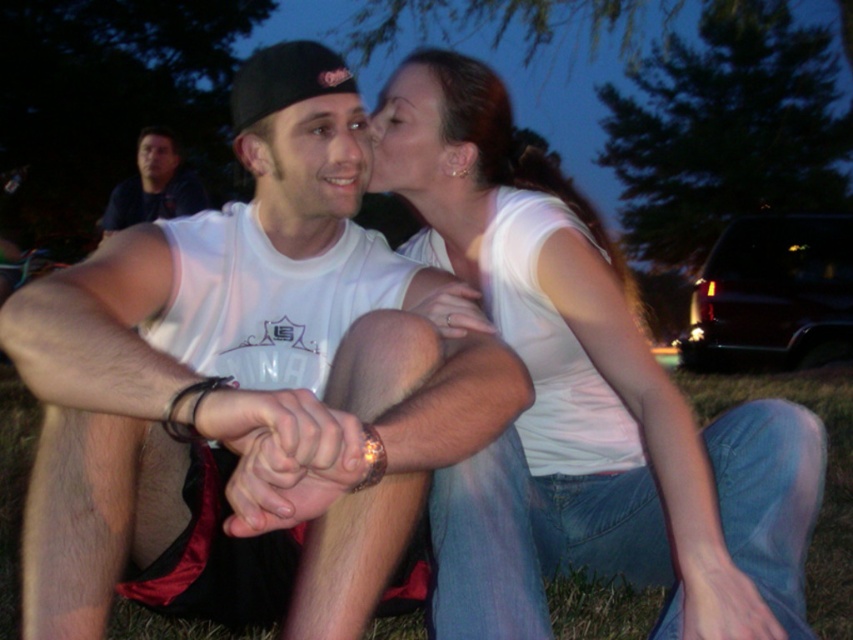
Which is more to the right, green grass at lower center or matte white t-shirt at center?

green grass at lower center

Is green grass at lower center smaller than matte white t-shirt at center?

Yes.

Is point (625, 600) farther from camera compared to point (318, 140)?

Yes, point (625, 600) is farther from viewer.

Locate an element on the screen. The height and width of the screenshot is (640, 853). green grass at lower center is located at coordinates (827, 474).

Which is in front, point (511, 205) or point (187, 200)?

Point (511, 205)

Which of these two, white matte shirt at upper center or dark blue shirt at upper left, stands shorter?

Standing shorter between the two is dark blue shirt at upper left.

Between point (488, 305) and point (142, 218), which one is positioned in front?

Positioned in front is point (488, 305).

Locate an element on the screen. white matte shirt at upper center is located at coordinates (598, 419).

Consider the image. How far apart are white matte shirt at upper center and matte white t-shirt at center?

They are 55.05 centimeters apart.

Is white matte shirt at upper center behind matte white t-shirt at center?

No, white matte shirt at upper center is in front of matte white t-shirt at center.

Where is `white matte shirt at upper center`? white matte shirt at upper center is located at coordinates (598, 419).

This screenshot has height=640, width=853. I want to click on white matte shirt at upper center, so click(x=598, y=419).